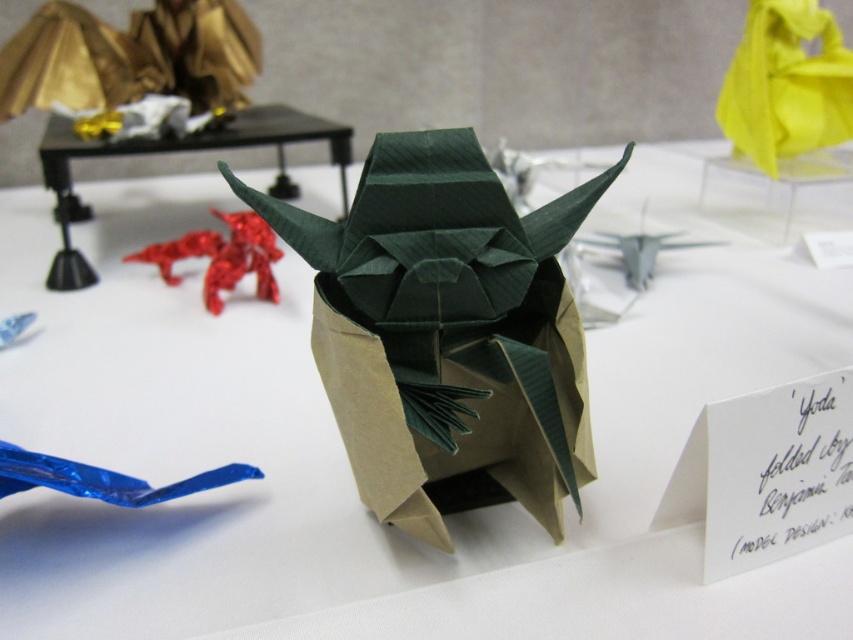
Question: Which point appears farthest from the camera in this image?

Choices:
 (A) (816, 232)
 (B) (791, 154)
 (C) (97, 147)

Answer: (B)

Question: Is yellow paper bag at upper right positioned behind black plastic table at upper center?

Choices:
 (A) no
 (B) yes

Answer: (B)

Question: Does black plastic table at upper center appear on the left side of white paper at center?

Choices:
 (A) yes
 (B) no

Answer: (A)

Question: Does yellow paper bag at upper right have a greater width compared to black plastic table at upper center?

Choices:
 (A) yes
 (B) no

Answer: (B)

Question: Based on their relative distances, which object is nearer to the white paper at center?

Choices:
 (A) yellow paper bag at upper right
 (B) black plastic table at upper center

Answer: (A)

Question: Which point is closer to the camera?

Choices:
 (A) (775, 141)
 (B) (57, 280)
 (C) (836, 257)

Answer: (B)